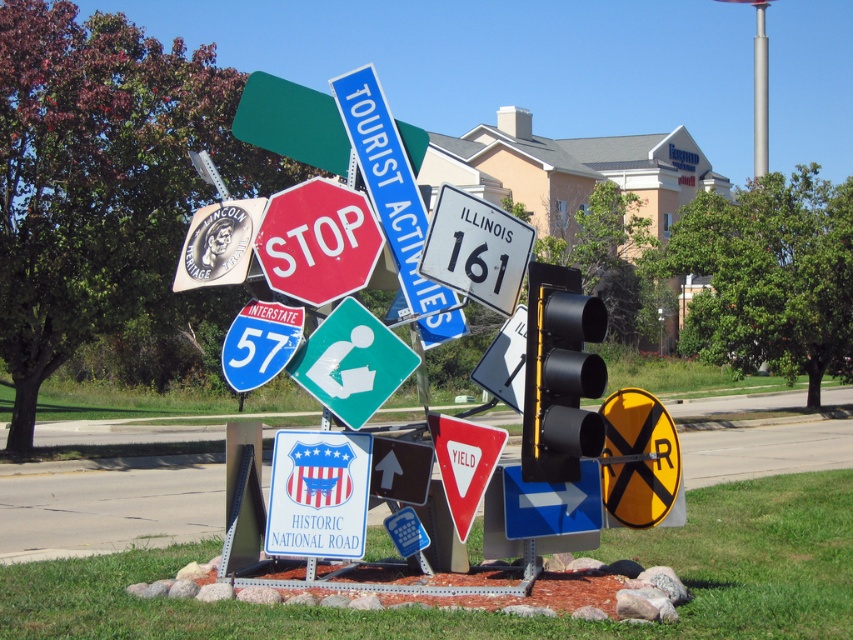
Does metallic red stop sign at center appear on the right side of white plastic illinois 161 sign at center?

Incorrect, metallic red stop sign at center is not on the right side of white plastic illinois 161 sign at center.

Between point (318, 230) and point (456, 209), which one is positioned behind?

Positioned behind is point (318, 230).

Does point (370, 253) come farther from viewer compared to point (463, 211)?

Yes, point (370, 253) is behind point (463, 211).

Locate an element on the screen. metallic red stop sign at center is located at coordinates (317, 241).

Is point (408, 346) behind point (635, 518)?

No, it is in front of (635, 518).

From the picture: Can you confirm if green plastic information sign at center is wider than yellowmaterial/texture railroad crossing sign at lower right?

Correct, the width of green plastic information sign at center exceeds that of yellowmaterial/texture railroad crossing sign at lower right.

At what (x,y) coordinates should I click in order to perform the action: click on green plastic information sign at center. Please return your answer as a coordinate pair (x, y). Image resolution: width=853 pixels, height=640 pixels. Looking at the image, I should click on (351, 362).

The height and width of the screenshot is (640, 853). Find the location of `green plastic information sign at center`. green plastic information sign at center is located at coordinates (351, 362).

Is black glossy arrow at center in front of silver metallic pole at upper right?

That is True.

Does black glossy arrow at center have a larger size compared to silver metallic pole at upper right?

No.

Is point (421, 477) positioned in front of point (763, 120)?

Yes, it is.

The height and width of the screenshot is (640, 853). In order to click on black glossy arrow at center in this screenshot , I will do `click(399, 470)`.